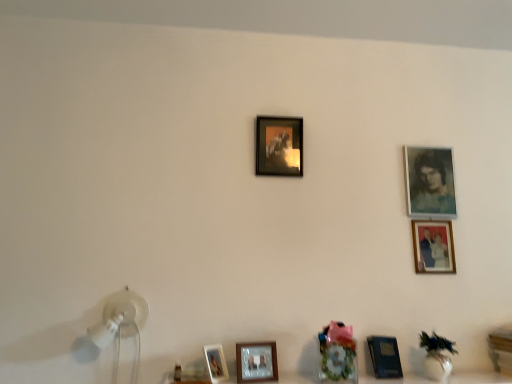
Where is `metallic blue picture frame at lower right, the sixth picture frame in the top-to-bottom sequence`? The height and width of the screenshot is (384, 512). metallic blue picture frame at lower right, the sixth picture frame in the top-to-bottom sequence is located at coordinates (385, 356).

Describe the element at coordinates (385, 356) in the screenshot. The height and width of the screenshot is (384, 512). I see `metallic blue picture frame at lower right, the 4th picture frame from the left` at that location.

Describe the element at coordinates (121, 326) in the screenshot. This screenshot has width=512, height=384. I see `white glossy table lamp at lower left` at that location.

Locate an element on the screen. The image size is (512, 384). white glossy table lamp at lower left is located at coordinates (121, 326).

Identify the location of matte glass photo frame at lower center, acting as the 5th picture frame starting from the top. This screenshot has height=384, width=512. [216, 363].

What do you see at coordinates (429, 181) in the screenshot? Image resolution: width=512 pixels, height=384 pixels. I see `blue textured portrait at upper right, which ranks as the second picture frame in top-to-bottom order` at bounding box center [429, 181].

Describe the element at coordinates (279, 146) in the screenshot. I see `matte black picture frame at center, the sixth picture frame ordered from the bottom` at that location.

Where is `matte glass picture frame at lower right, the fourth picture frame in the bottom-to-top sequence`? matte glass picture frame at lower right, the fourth picture frame in the bottom-to-top sequence is located at coordinates (433, 246).

Identify the location of the 3rd picture frame below the matte glass picture frame at lower right, marked as the third picture frame in a top-to-bottom arrangement (from the image's perspective). The width and height of the screenshot is (512, 384). (385, 356).

From a real-world perspective, does metallic blue picture frame at lower right, the sixth picture frame in the top-to-bottom sequence, stand above matte glass picture frame at lower right, the fifth picture frame positioned from the left?

Incorrect, from a real-world perspective, metallic blue picture frame at lower right, the sixth picture frame in the top-to-bottom sequence, is lower than matte glass picture frame at lower right, the fifth picture frame positioned from the left.

Between metallic blue picture frame at lower right, placed as the first picture frame when sorted from bottom to top, and matte glass picture frame at lower right, the 2th picture frame viewed from the right, which one has larger size?

metallic blue picture frame at lower right, placed as the first picture frame when sorted from bottom to top, is bigger.

Looking at their sizes, would you say white glossy table lamp at lower left is wider or thinner than wooden table at lower right?

Clearly, white glossy table lamp at lower left has less width compared to wooden table at lower right.

Is white glossy table lamp at lower left next to wooden table at lower right?

No, white glossy table lamp at lower left is not making contact with wooden table at lower right.

Can you confirm if white glossy table lamp at lower left is smaller than wooden table at lower right?

Incorrect, white glossy table lamp at lower left is not smaller in size than wooden table at lower right.

Which is in front, point (109, 330) or point (433, 180)?

Positioned in front is point (109, 330).

The image size is (512, 384). In order to click on table lamp below the blue textured portrait at upper right, acting as the fifth picture frame starting from the bottom (from a real-world perspective) in this screenshot , I will do `click(121, 326)`.

Considering the sizes of objects white glossy table lamp at lower left and blue textured portrait at upper right, which appears as the sixth picture frame when viewed from the left, in the image provided, who is smaller, white glossy table lamp at lower left or blue textured portrait at upper right, which appears as the sixth picture frame when viewed from the left,?

Smaller between the two is blue textured portrait at upper right, which appears as the sixth picture frame when viewed from the left.

Does white glossy table lamp at lower left come behind blue textured portrait at upper right, which ranks as the second picture frame in top-to-bottom order?

That is False.

Is matte glass picture frame at center, positioned as the fourth picture frame in top-to-bottom order, positioned with its back to metallic blue picture frame at lower right, the sixth picture frame in the top-to-bottom sequence?

No, matte glass picture frame at center, positioned as the fourth picture frame in top-to-bottom order, is not facing away from metallic blue picture frame at lower right, the sixth picture frame in the top-to-bottom sequence.

Can you confirm if matte glass picture frame at center, positioned as the fourth picture frame in top-to-bottom order, is smaller than metallic blue picture frame at lower right, placed as the first picture frame when sorted from bottom to top?

Yes, matte glass picture frame at center, positioned as the fourth picture frame in top-to-bottom order, is smaller than metallic blue picture frame at lower right, placed as the first picture frame when sorted from bottom to top.

Which is closer, (251,368) or (396,360)?

Point (251,368) appears to be closer to the viewer than point (396,360).

From the picture: Can you tell me how much matte glass picture frame at center, the 5th picture frame positioned from the right, and metallic blue picture frame at lower right, the sixth picture frame in the top-to-bottom sequence, differ in facing direction?

13 degrees separate the facing orientations of matte glass picture frame at center, the 5th picture frame positioned from the right, and metallic blue picture frame at lower right, the sixth picture frame in the top-to-bottom sequence.

Considering the relative positions of blue textured portrait at upper right, which ranks as the second picture frame in top-to-bottom order, and matte black picture frame at center, which is counted as the 3th picture frame, starting from the left, in the image provided, is blue textured portrait at upper right, which ranks as the second picture frame in top-to-bottom order, to the left or to the right of matte black picture frame at center, which is counted as the 3th picture frame, starting from the left,?

Based on their positions, blue textured portrait at upper right, which ranks as the second picture frame in top-to-bottom order, is located to the right of matte black picture frame at center, which is counted as the 3th picture frame, starting from the left.

Is blue textured portrait at upper right, acting as the fifth picture frame starting from the bottom, spatially inside matte black picture frame at center, the 1th picture frame from the top, or outside of it?

blue textured portrait at upper right, acting as the fifth picture frame starting from the bottom, is spatially situated outside matte black picture frame at center, the 1th picture frame from the top.

Considering the positions of points (241, 367) and (219, 346), is point (241, 367) closer to camera compared to point (219, 346)?

Yes.

Is matte glass picture frame at center, positioned as the fourth picture frame in top-to-bottom order, at the right side of matte glass photo frame at lower center, acting as the 5th picture frame starting from the top?

Yes.

Is matte glass picture frame at center, which ranks as the 2th picture frame in left-to-right order, turned away from matte glass photo frame at lower center, acting as the 5th picture frame starting from the top?

matte glass picture frame at center, which ranks as the 2th picture frame in left-to-right order, does not have its back to matte glass photo frame at lower center, acting as the 5th picture frame starting from the top.

From the image's perspective, is matte glass picture frame at lower right, the fifth picture frame positioned from the left, located above white glossy table lamp at lower left?

Indeed, from the image's perspective, matte glass picture frame at lower right, the fifth picture frame positioned from the left, is shown above white glossy table lamp at lower left.

Based on the photo, is matte glass picture frame at lower right, the fourth picture frame in the bottom-to-top sequence, facing towards white glossy table lamp at lower left?

No, matte glass picture frame at lower right, the fourth picture frame in the bottom-to-top sequence, does not turn towards white glossy table lamp at lower left.

From a real-world perspective, which is physically above, matte glass picture frame at lower right, the 2th picture frame viewed from the right, or white glossy table lamp at lower left?

matte glass picture frame at lower right, the 2th picture frame viewed from the right, is physically above.

Starting from the metallic blue picture frame at lower right, the sixth picture frame in the top-to-bottom sequence, which picture frame is the 1st one behind? Please provide its 2D coordinates.

[(433, 246)]

You are a GUI agent. You are given a task and a screenshot of the screen. Output one action in this format:
    pyautogui.click(x=<x>, y=<y>)
    Task: Click on the table lamp that appears on the left of wooden table at lower right
    
    Given the screenshot: What is the action you would take?
    pyautogui.click(x=121, y=326)

Which object lies further to the anchor point matte glass photo frame at lower center, acting as the 5th picture frame starting from the top, matte glass picture frame at lower right, the fourth picture frame in the bottom-to-top sequence, or white glossy table lamp at lower left?

matte glass picture frame at lower right, the fourth picture frame in the bottom-to-top sequence, lies further to matte glass photo frame at lower center, acting as the 5th picture frame starting from the top, than the other object.

Consider the image. Looking at the image, which one is located further to white glossy table lamp at lower left, wooden table at lower right or metallic blue picture frame at lower right, the 4th picture frame from the left?

wooden table at lower right lies further to white glossy table lamp at lower left than the other object.

Looking at the image, which one is located closer to matte glass picture frame at center, which appears as the third picture frame when ordered from the bottom, blue textured portrait at upper right, the first picture frame when ordered from right to left, or matte glass photo frame at lower center, which is the sixth picture frame from right to left?

The object closer to matte glass picture frame at center, which appears as the third picture frame when ordered from the bottom, is matte glass photo frame at lower center, which is the sixth picture frame from right to left.

From the image, which object appears to be farther from matte black picture frame at center, which is counted as the 3th picture frame, starting from the left, metallic blue picture frame at lower right, which is counted as the third picture frame, starting from the right, or matte glass picture frame at lower right, marked as the third picture frame in a top-to-bottom arrangement?

Among the two, metallic blue picture frame at lower right, which is counted as the third picture frame, starting from the right, is located further to matte black picture frame at center, which is counted as the 3th picture frame, starting from the left.

Based on the photo, based on their spatial positions, is wooden table at lower right or matte glass picture frame at lower right, the fourth picture frame in the bottom-to-top sequence, closer to matte black picture frame at center, the 4th picture frame positioned from the right?

matte glass picture frame at lower right, the fourth picture frame in the bottom-to-top sequence, is closer to matte black picture frame at center, the 4th picture frame positioned from the right.

Considering their positions, is matte glass picture frame at lower right, the fifth picture frame positioned from the left, positioned closer to metallic blue picture frame at lower right, the 4th picture frame from the left, than blue textured portrait at upper right, acting as the fifth picture frame starting from the bottom?

Among the two, matte glass picture frame at lower right, the fifth picture frame positioned from the left, is located nearer to metallic blue picture frame at lower right, the 4th picture frame from the left.

Estimate the real-world distances between objects in this image. Which object is further from matte glass picture frame at center, the 5th picture frame positioned from the right, metallic blue picture frame at lower right, the 4th picture frame from the left, or matte glass picture frame at lower right, the 2th picture frame viewed from the right?

matte glass picture frame at lower right, the 2th picture frame viewed from the right, lies further to matte glass picture frame at center, the 5th picture frame positioned from the right, than the other object.

Based on their spatial positions, is blue textured portrait at upper right, which ranks as the second picture frame in top-to-bottom order, or white glossy table lamp at lower left further from metallic blue picture frame at lower right, the 4th picture frame from the left?

white glossy table lamp at lower left is further to metallic blue picture frame at lower right, the 4th picture frame from the left.

Locate an element on the screen. table lamp between matte black picture frame at center, the 4th picture frame positioned from the right, and matte glass photo frame at lower center, which is the sixth picture frame from right to left, from top to bottom is located at coordinates (121, 326).

Find the location of a particular element. picture frame situated between white glossy table lamp at lower left and matte glass picture frame at center, which appears as the third picture frame when ordered from the bottom, from left to right is located at coordinates (216, 363).

At what (x,y) coordinates should I click in order to perform the action: click on table between matte black picture frame at center, the sixth picture frame ordered from the bottom, and metallic blue picture frame at lower right, the 4th picture frame from the left, from top to bottom. Please return your answer as a coordinate pair (x, y). Looking at the image, I should click on (502, 348).

Identify the location of table lamp between matte black picture frame at center, the 4th picture frame positioned from the right, and matte glass picture frame at center, the 5th picture frame positioned from the right, from top to bottom. The width and height of the screenshot is (512, 384). (121, 326).